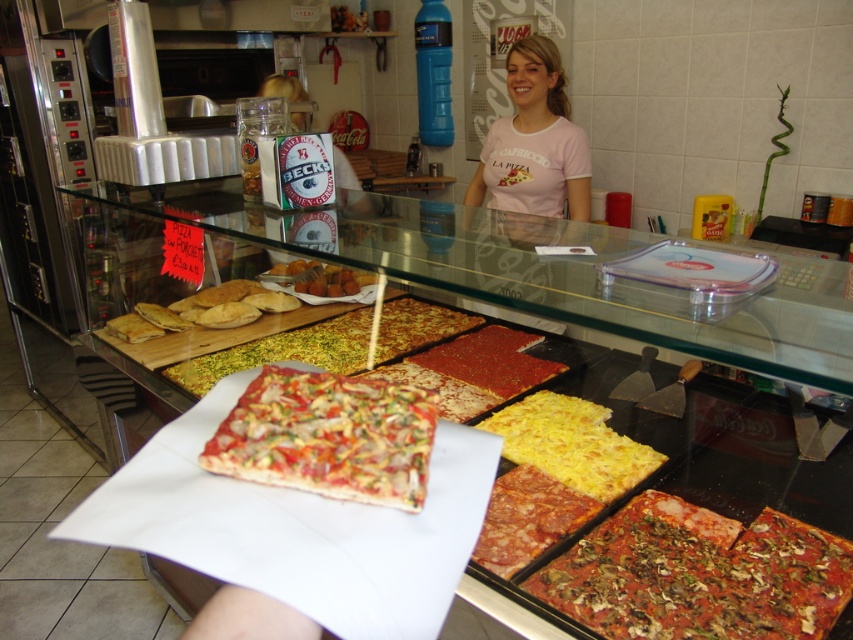
Question: Which object is the closest to the crusty golden pizza at center?

Choices:
 (A) reddish-brown crispy pizza at lower right
 (B) golden crispy pizza at center
 (C) pink cotton t-shirt at upper center

Answer: (B)

Question: Is crustless pizza with colorful toppings at center to the right of crusty golden pizza at center from the viewer's perspective?

Choices:
 (A) yes
 (B) no

Answer: (A)

Question: In this image, where is red pepperoni pizza at center located relative to golden crispy pizza at center?

Choices:
 (A) above
 (B) below

Answer: (B)

Question: Which point is closer to the camera?

Choices:
 (A) golden crispy pizza at center
 (B) crustless pizza with colorful toppings at center
 (C) reddish-brown crispy pizza at lower right
 (D) yellow cheese pizza at center

Answer: (B)

Question: Which point appears closest to the camera in this image?

Choices:
 (A) (498, 522)
 (B) (302, 129)

Answer: (A)

Question: Considering the relative positions of crusty golden pizza at center and golden crispy pizza at center in the image provided, where is crusty golden pizza at center located with respect to golden crispy pizza at center?

Choices:
 (A) right
 (B) left

Answer: (A)